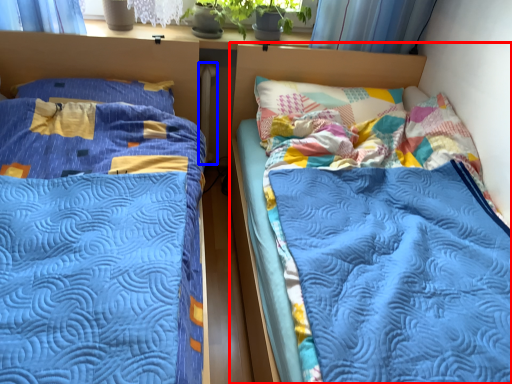
Question: Among these objects, which one is nearest to the camera, bed (highlighted by a red box) or radiator (highlighted by a blue box)?

Choices:
 (A) bed
 (B) radiator

Answer: (A)